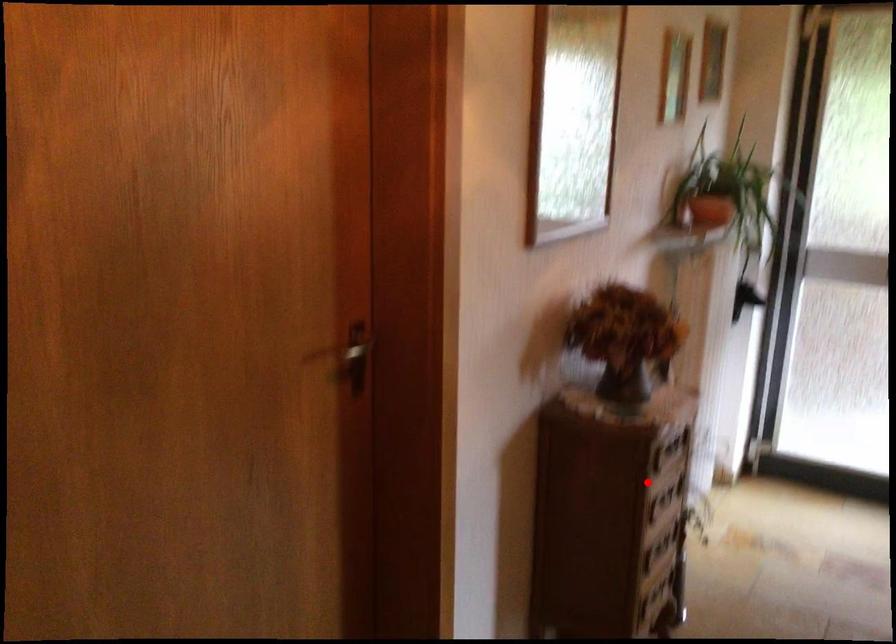
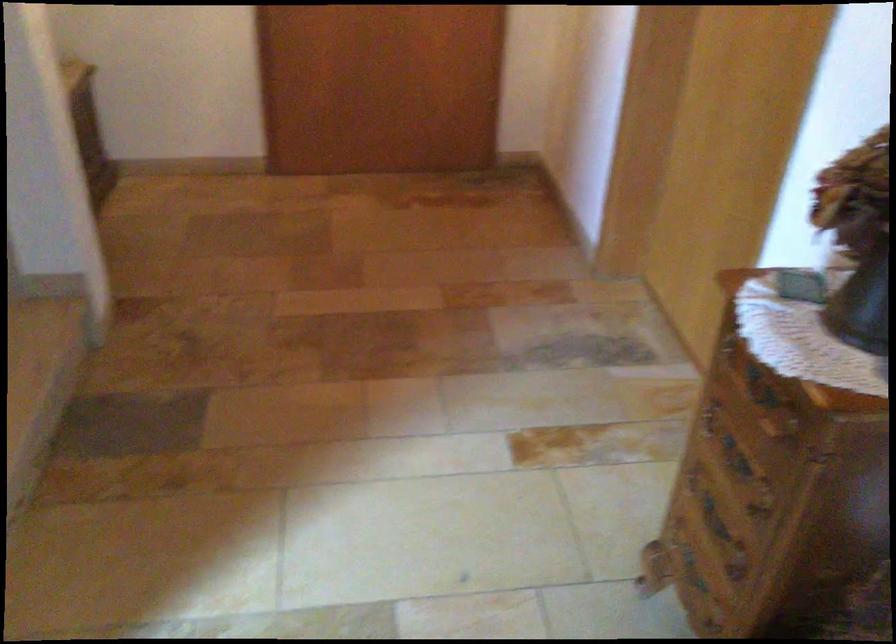
Question: I am providing you with two images of the same scene from different viewpoints. A red point is shown in image1. For the corresponding object point in image2, is it positioned nearer or farther from the camera?

Choices:
 (A) Nearer
 (B) Farther

Answer: (A)